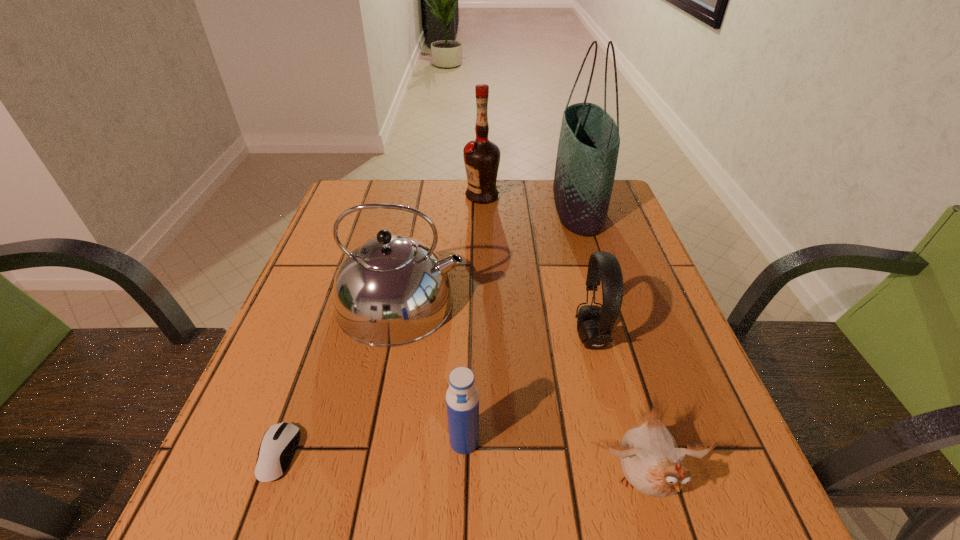
This screenshot has height=540, width=960. In order to click on free point between the second tallest object and the second shortest object in this screenshot , I will do `click(563, 340)`.

The width and height of the screenshot is (960, 540). Identify the location of blank region between the water bottle and the mouse. (372, 448).

Where is `empty space that is in between the water bottle and the second tallest object`? The height and width of the screenshot is (540, 960). empty space that is in between the water bottle and the second tallest object is located at coordinates (473, 319).

Identify the location of the fifth closest object to the shortest object. (589, 140).

Identify which object is the closest to the shortest object. Please provide its 2D coordinates. Your answer should be formatted as a tuple, i.e. [(x, y)], where the tuple contains the x and y coordinates of a point satisfying the conditions above.

[(392, 290)]

Locate an element on the screen. vacant space that satisfies the following two spatial constraints: 1. on the front and back of the tallest object; 2. on the left side of the sixth shortest object is located at coordinates (482, 207).

You are a GUI agent. You are given a task and a screenshot of the screen. Output one action in this format:
    pyautogui.click(x=<x>, y=<y>)
    Task: Click on the free space that satisfies the following two spatial constraints: 1. on the front and back of the second tallest object; 2. on the back side of the tote bag
    The height and width of the screenshot is (540, 960).
    Given the screenshot: What is the action you would take?
    pyautogui.click(x=482, y=207)

I want to click on free space in the image that satisfies the following two spatial constraints: 1. from the spout of the third tallest object; 2. on the back side of the water bottle, so [374, 441].